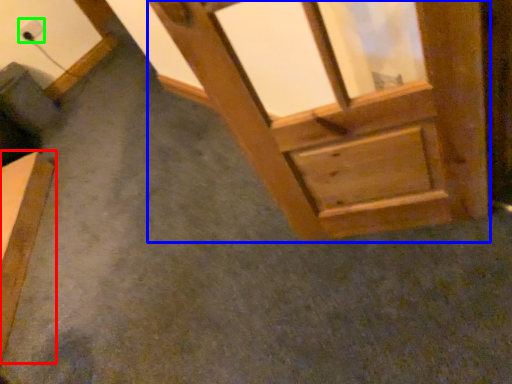
Question: Which is nearer to the furniture (highlighted by a red box)? window frame (highlighted by a blue box) or electric outlet (highlighted by a green box).

Choices:
 (A) window frame
 (B) electric outlet

Answer: (B)